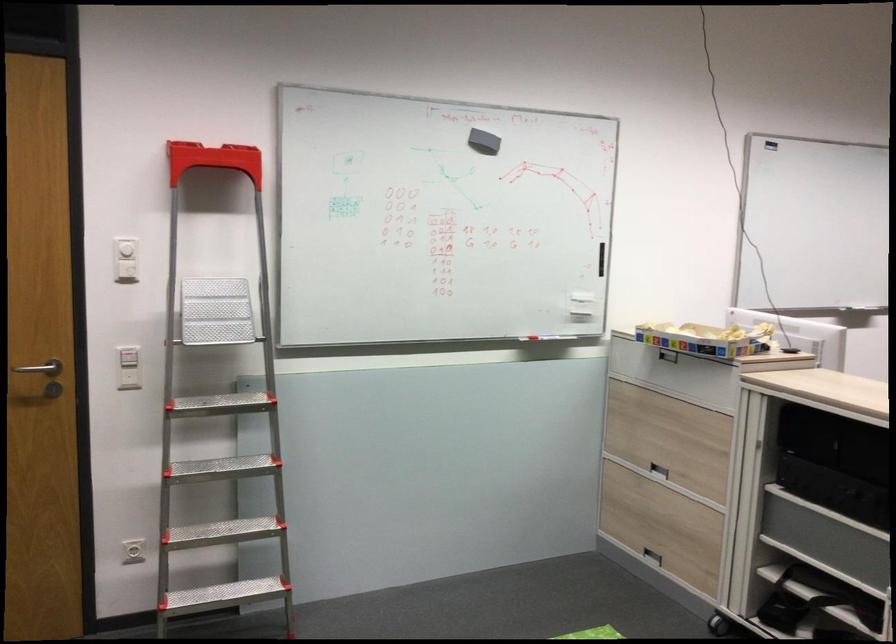
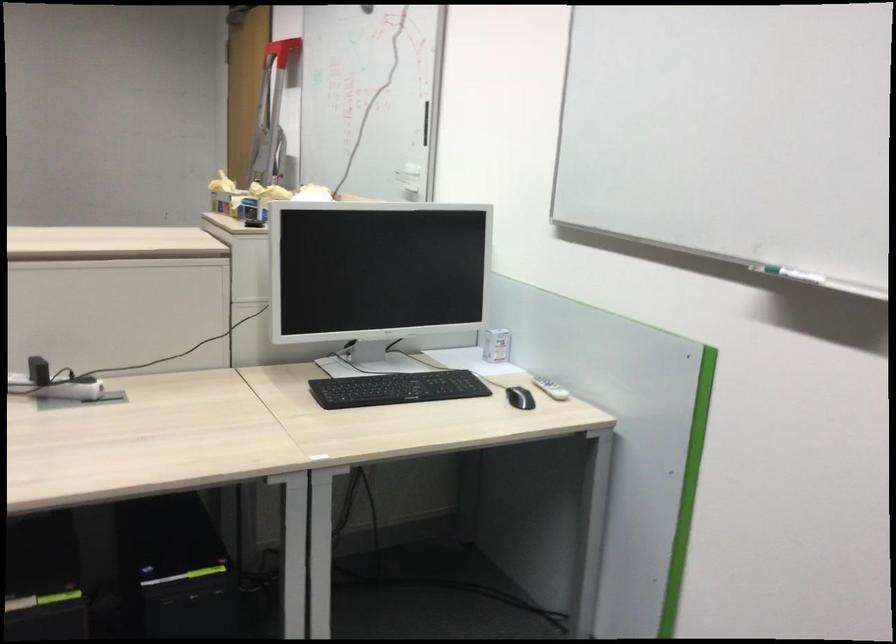
Question: I am providing you with two images of the same scene from different viewpoints. Please identify which objects are invisible in image2.

Choices:
 (A) white wall button
 (B) small white box
 (C) white remote control
 (D) black and blue reel

Answer: (A)